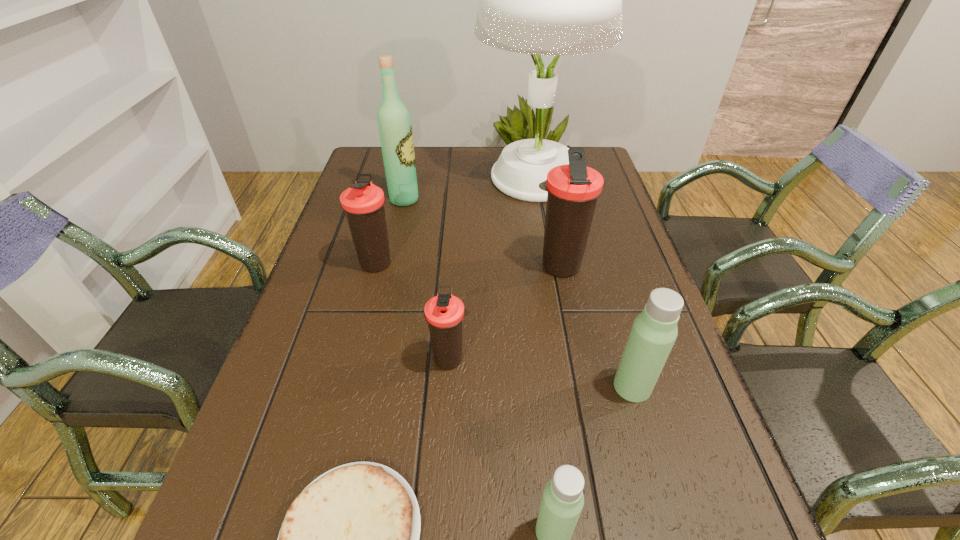
You are a GUI agent. You are given a task and a screenshot of the screen. Output one action in this format:
    pyautogui.click(x=<x>, y=<y>)
    Task: Click on the free point that satisfies the following two spatial constraints: 1. on the front-facing side of the biggest brown thermos bottle; 2. on the right side of the wine bottle
    This screenshot has width=960, height=540.
    Given the screenshot: What is the action you would take?
    pyautogui.click(x=390, y=267)

Find the location of a particular element. Image resolution: width=960 pixels, height=540 pixels. vacant position in the image that satisfies the following two spatial constraints: 1. on the front side of the second smallest brown thermos bottle; 2. on the right side of the bigger light thermos bottle is located at coordinates (347, 387).

At what (x,y) coordinates should I click in order to perform the action: click on blank area in the image that satisfies the following two spatial constraints: 1. on the front-facing side of the wine bottle; 2. on the back side of the smallest brown thermos bottle. Please return your answer as a coordinate pair (x, y). The width and height of the screenshot is (960, 540). Looking at the image, I should click on (369, 358).

This screenshot has height=540, width=960. In order to click on blank area in the image that satisfies the following two spatial constraints: 1. on the back side of the biggest brown thermos bottle; 2. on the front-facing side of the wine bottle in this screenshot , I will do `click(545, 200)`.